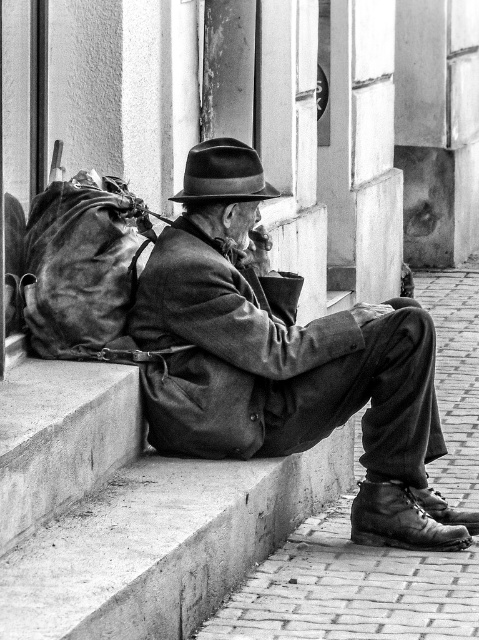
Between point (212, 284) and point (220, 189), which one is positioned in front?

Positioned in front is point (212, 284).

Who is more forward, [411,509] or [250,172]?

Positioned in front is point [250,172].

Where is `leather jacket at center`? This screenshot has width=479, height=640. leather jacket at center is located at coordinates (285, 358).

What do you see at coordinates (162, 545) in the screenshot? I see `concrete at lower left` at bounding box center [162, 545].

Which of these two, concrete at lower left or leather backpack at left, stands taller?

leather backpack at left is taller.

Is point (21, 550) more distant than point (61, 241)?

No, (21, 550) is closer to viewer.

Image resolution: width=479 pixels, height=640 pixels. I want to click on concrete at lower left, so click(x=162, y=545).

Is leather jacket at center wider than concrete at lower left?

Yes, leather jacket at center is wider than concrete at lower left.

From the picture: Who is higher up, leather jacket at center or concrete at lower left?

leather jacket at center

Image resolution: width=479 pixels, height=640 pixels. What do you see at coordinates (285, 358) in the screenshot?
I see `leather jacket at center` at bounding box center [285, 358].

Identify the location of leather jacket at center. This screenshot has width=479, height=640. (285, 358).